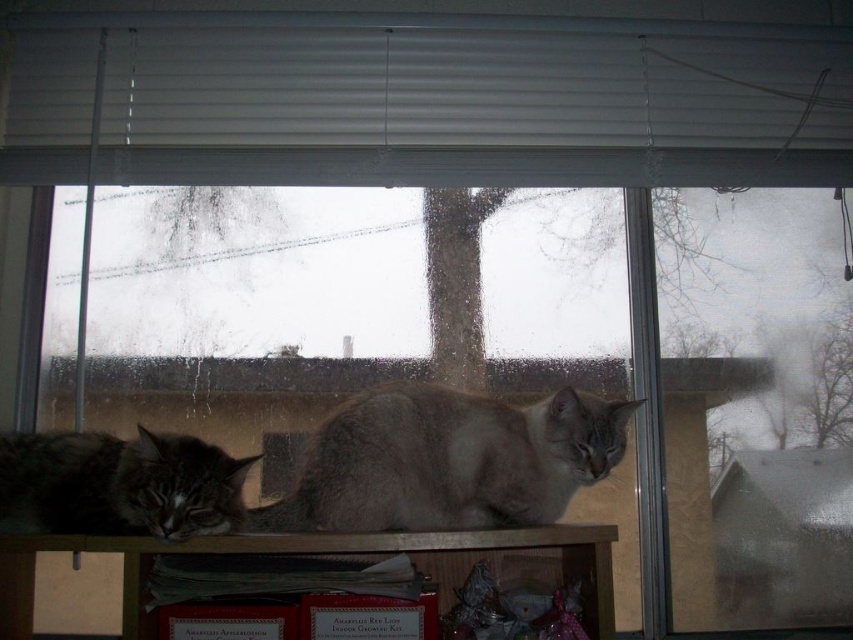
You are a cat owner trying to determine if your cats can reach the white matte blinds at upper center from their current positions on the wooden shelf. Based on the scene description, can the cats reach the blinds?

The white matte blinds at upper center are located at point (466, 88), which is above the cats on the wooden shelf. Since the cats are on the shelf below, they cannot physically reach the blinds unless they can jump or climb higher, but the scene does not mention any climbing aids or the cats attempting to reach the blinds. Therefore, it is unlikely the cats can reach the blinds from their current positions.

You are a small toy mouse that wants to roll from the gray fluffy cat at lower left to the wooden shelf at lower center. Can you make it without falling off the shelf?

The gray fluffy cat at lower left and wooden shelf at lower center are 4.87 inches apart. Since you are a small toy mouse, you can roll the distance between them without falling off the shelf.